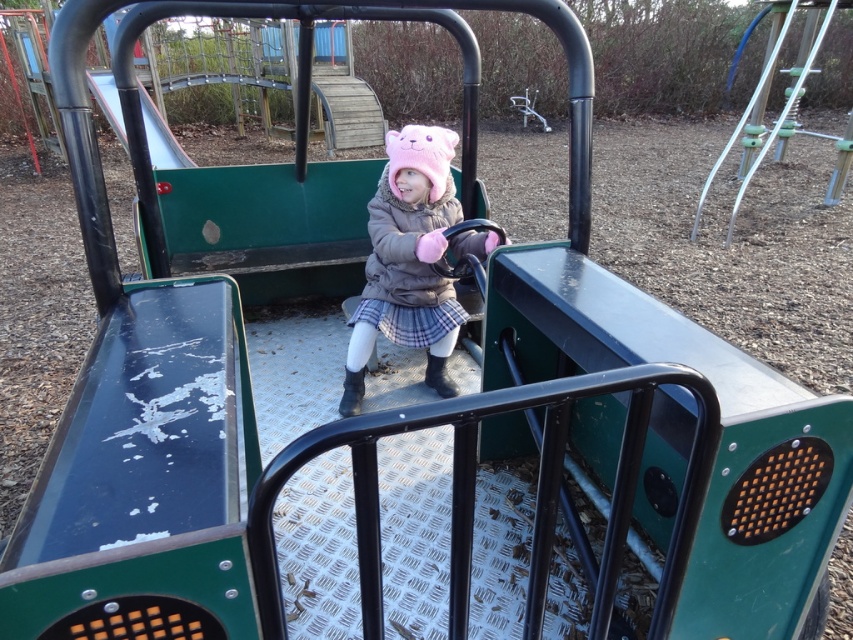
Between point (403, 136) and point (158, 144), which one is positioned behind?

The point (158, 144) is more distant.

Is pink fuzzy hat at center below smooth metal slide at upper left?

Yes, pink fuzzy hat at center is below smooth metal slide at upper left.

Identify the location of pink fuzzy hat at center. (410, 260).